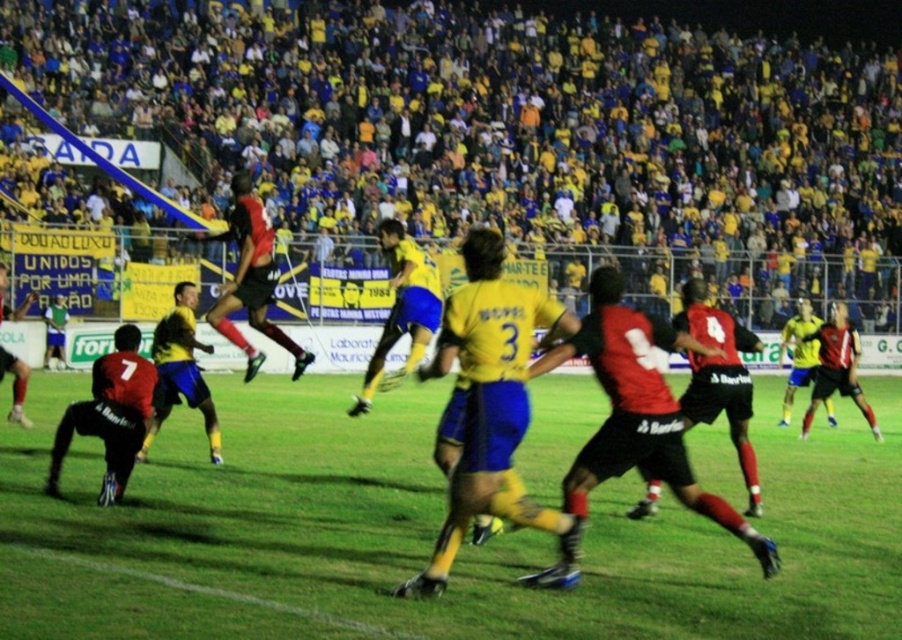
Can you confirm if green grass football field at center is positioned to the right of matte black jersey at lower left?

Yes, green grass football field at center is to the right of matte black jersey at lower left.

Does green grass football field at center appear over matte black jersey at lower left?

Incorrect, green grass football field at center is not positioned above matte black jersey at lower left.

I want to click on green grass football field at center, so click(425, 534).

Where is `green grass football field at center`? This screenshot has width=902, height=640. green grass football field at center is located at coordinates (425, 534).